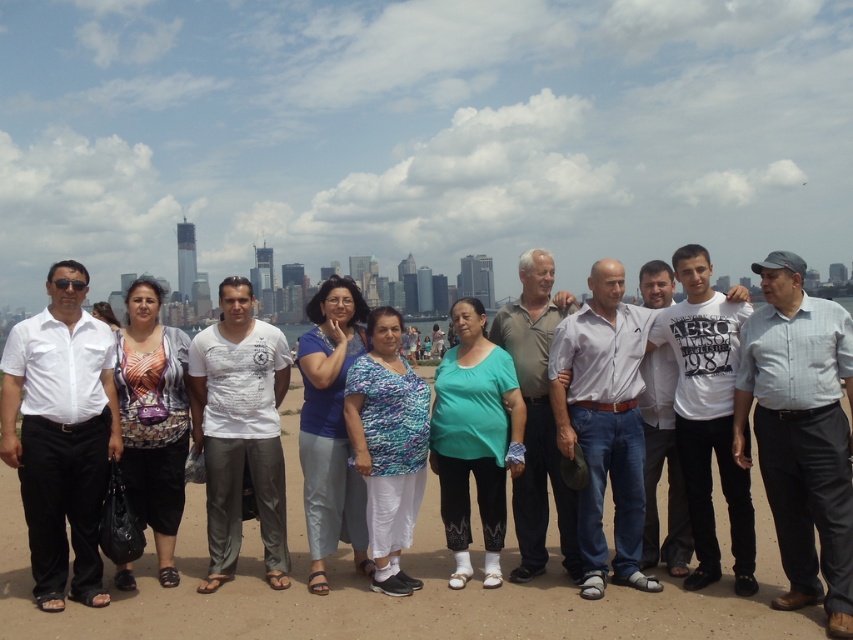
Question: Which of these objects is positioned closest to the white cotton shirt at left?

Choices:
 (A) printed fabric blouse at center
 (B) blue fabric pants at center
 (C) white cotton shirt at center

Answer: (A)

Question: In this image, where is gray cotton shirt at center located relative to printed fabric blouse at center?

Choices:
 (A) above
 (B) below

Answer: (B)

Question: Which is nearer to the blue fabric pants at center?

Choices:
 (A) white cotton shirt at center
 (B) green matte shirt at center
 (C) printed cotton shirt at center

Answer: (C)

Question: Does white cotton shirt at left lie behind printed fabric blouse at center?

Choices:
 (A) no
 (B) yes

Answer: (A)

Question: Which of the following is the closest to the observer?

Choices:
 (A) printed cotton shirt at center
 (B) white cotton shirt at center
 (C) gray cotton shirt at center
 (D) green matte shirt at center

Answer: (C)

Question: Can you confirm if white cotton shirt at left is bigger than green matte shirt at center?

Choices:
 (A) yes
 (B) no

Answer: (A)